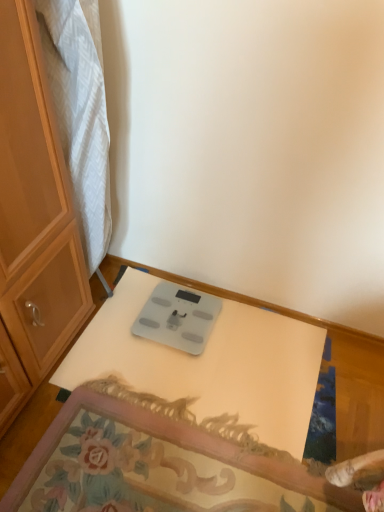
The height and width of the screenshot is (512, 384). What are the coordinates of `free location to the right of matte wood cabinet at left` in the screenshot? It's located at coord(167,301).